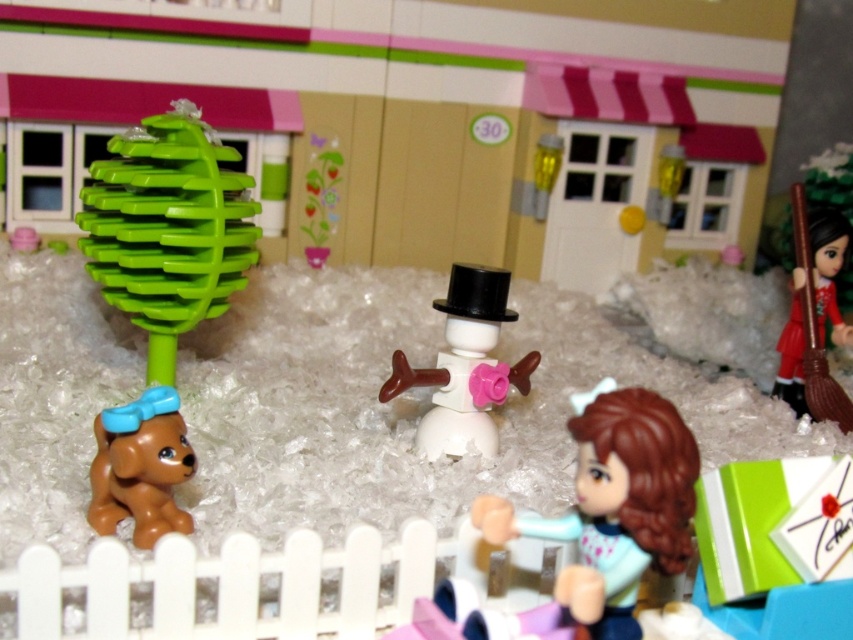
Question: Can you confirm if green plastic ball at upper left is thinner than white matte snowman at center?

Choices:
 (A) no
 (B) yes

Answer: (A)

Question: Is white matte snowman at center to the left of brown glossy dog at lower left from the viewer's perspective?

Choices:
 (A) yes
 (B) no

Answer: (B)

Question: Which point appears farthest from the camera in this image?

Choices:
 (A) (792, 321)
 (B) (115, 426)

Answer: (A)

Question: Which point is closer to the camera taking this photo?

Choices:
 (A) (827, 292)
 (B) (492, 280)
 (C) (604, 611)
 (D) (90, 189)

Answer: (C)

Question: Does green plastic ball at upper left have a larger size compared to brown glossy dog at lower left?

Choices:
 (A) yes
 (B) no

Answer: (A)

Question: Among these points, which one is nearest to the camera?

Choices:
 (A) (425, 371)
 (B) (161, 228)
 (C) (848, 400)
 (D) (691, 481)

Answer: (D)